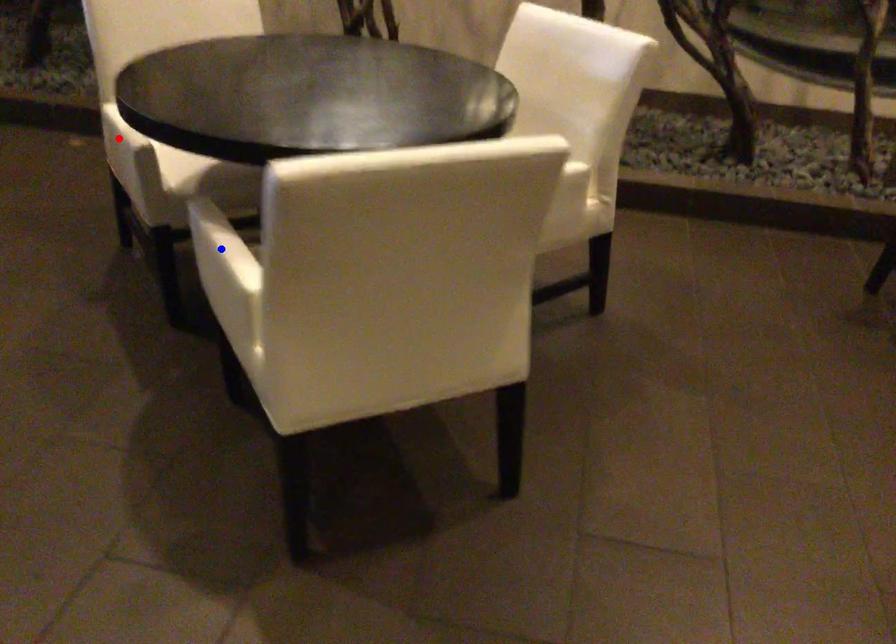
Question: Which of the two points in the image is closer to the camera?

Choices:
 (A) Blue point is closer.
 (B) Red point is closer.

Answer: (A)